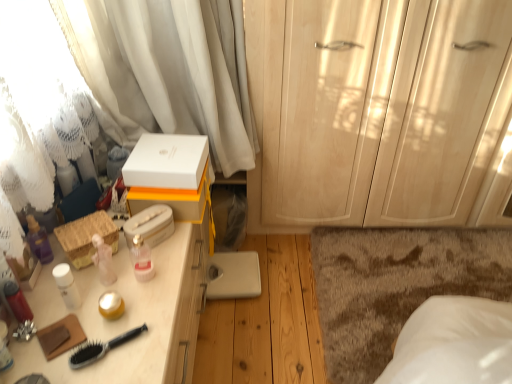
Where is `vacant area in front of woven straw basket at left, arranged as the first storage box when ordered from the bottom`? The image size is (512, 384). vacant area in front of woven straw basket at left, arranged as the first storage box when ordered from the bottom is located at coordinates (77, 292).